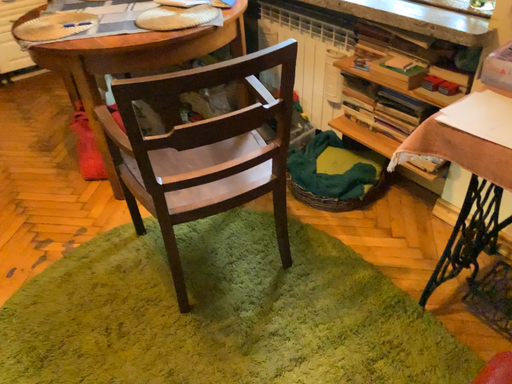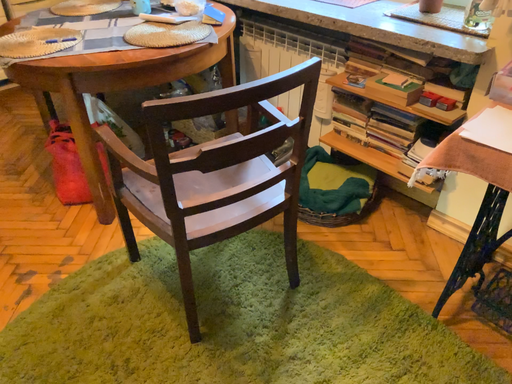
Question: Which way did the camera rotate in the video?

Choices:
 (A) rotated left
 (B) rotated right

Answer: (B)